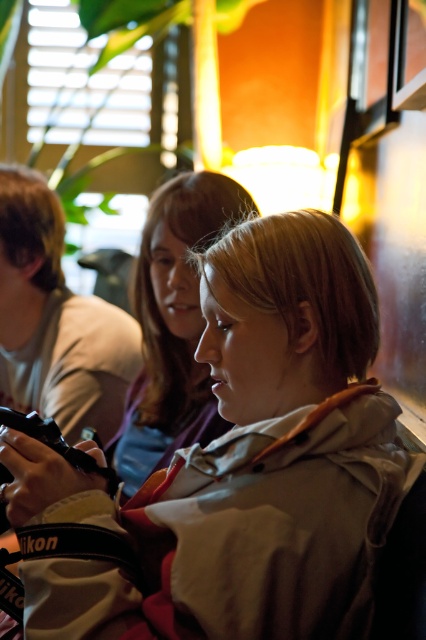
In the scene shown: Can you confirm if matte gray jacket at center is thinner than matte beige hoodie at center?

In fact, matte gray jacket at center might be wider than matte beige hoodie at center.

Image resolution: width=426 pixels, height=640 pixels. Describe the element at coordinates (244, 465) in the screenshot. I see `matte gray jacket at center` at that location.

Which is in front, point (353, 262) or point (141, 250)?

Positioned in front is point (353, 262).

Where is `matte gray jacket at center`? The width and height of the screenshot is (426, 640). matte gray jacket at center is located at coordinates (244, 465).